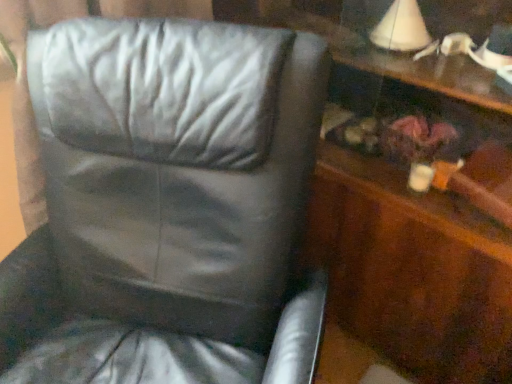
Question: Is black leather chair at center next to wooden dresser at right?

Choices:
 (A) no
 (B) yes

Answer: (A)

Question: Considering the relative sizes of black leather chair at center and wooden dresser at right in the image provided, is black leather chair at center smaller than wooden dresser at right?

Choices:
 (A) no
 (B) yes

Answer: (A)

Question: Is black leather chair at center positioned with its back to wooden dresser at right?

Choices:
 (A) yes
 (B) no

Answer: (A)

Question: Is black leather chair at center not inside wooden dresser at right?

Choices:
 (A) yes
 (B) no

Answer: (A)

Question: From a real-world perspective, is black leather chair at center on top of wooden dresser at right?

Choices:
 (A) no
 (B) yes

Answer: (A)

Question: From the image's perspective, is black leather chair at center beneath wooden dresser at right?

Choices:
 (A) no
 (B) yes

Answer: (B)

Question: From a real-world perspective, is wooden dresser at right under black leather chair at center?

Choices:
 (A) no
 (B) yes

Answer: (A)

Question: Would you say black leather chair at center is part of wooden dresser at right's contents?

Choices:
 (A) yes
 (B) no

Answer: (B)

Question: Considering the relative positions of wooden dresser at right and black leather chair at center in the image provided, is wooden dresser at right to the left of black leather chair at center from the viewer's perspective?

Choices:
 (A) no
 (B) yes

Answer: (A)

Question: Is wooden dresser at right positioned beyond the bounds of black leather chair at center?

Choices:
 (A) no
 (B) yes

Answer: (B)

Question: Is wooden dresser at right next to black leather chair at center and touching it?

Choices:
 (A) yes
 (B) no

Answer: (B)

Question: From the image's perspective, is wooden dresser at right below black leather chair at center?

Choices:
 (A) no
 (B) yes

Answer: (A)

Question: Looking at the image, does black leather chair at center seem bigger or smaller compared to wooden dresser at right?

Choices:
 (A) big
 (B) small

Answer: (A)